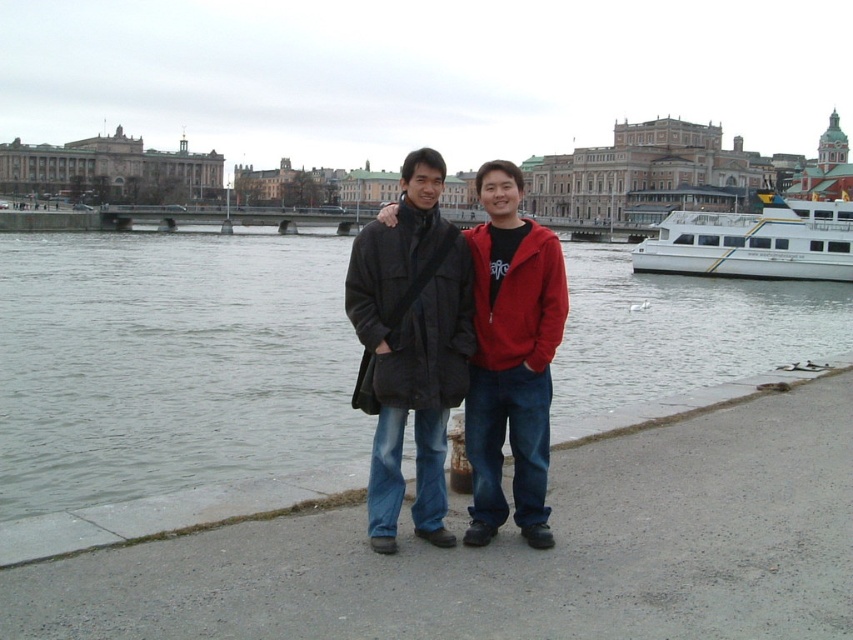
Which of these two, gray concrete pavement at lower center or white glossy boat at right, stands taller?

white glossy boat at right is taller.

Who is more forward, (x=799, y=582) or (x=834, y=209)?

Positioned in front is point (x=799, y=582).

Locate an element on the screen. gray concrete pavement at lower center is located at coordinates click(519, 552).

How far apart are matte black coat at center and matte red jacket at center?

The distance of matte black coat at center from matte red jacket at center is 12.61 inches.

Measure the distance between point [490,445] and camera.

67.97 feet

Image resolution: width=853 pixels, height=640 pixels. What do you see at coordinates (511, 356) in the screenshot? I see `matte black coat at center` at bounding box center [511, 356].

At what (x,y) coordinates should I click in order to perform the action: click on matte black coat at center. Please return your answer as a coordinate pair (x, y). This screenshot has width=853, height=640. Looking at the image, I should click on (511, 356).

Which of these two, gray water at lower left or matte red jacket at center, stands shorter?

Standing shorter between the two is matte red jacket at center.

Does point (68, 273) lie behind point (512, 205)?

That is True.

At what (x,y) coordinates should I click in order to perform the action: click on gray water at lower left. Please return your answer as a coordinate pair (x, y). The width and height of the screenshot is (853, 640). Looking at the image, I should click on (170, 364).